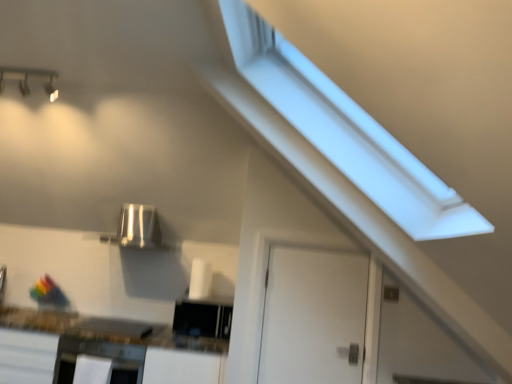
Question: Is satin silver appliance at center, acting as the first appliance starting from the left, far away from white matte door at center?

Choices:
 (A) no
 (B) yes

Answer: (B)

Question: Is satin silver appliance at center, marked as the second appliance in a bottom-to-top arrangement, located outside white matte door at center?

Choices:
 (A) yes
 (B) no

Answer: (A)

Question: Considering the relative sizes of satin silver appliance at center, marked as the second appliance in a bottom-to-top arrangement, and white matte door at center in the image provided, is satin silver appliance at center, marked as the second appliance in a bottom-to-top arrangement, wider than white matte door at center?

Choices:
 (A) no
 (B) yes

Answer: (B)

Question: Can you confirm if satin silver appliance at center, marked as the second appliance in a bottom-to-top arrangement, is taller than white matte door at center?

Choices:
 (A) no
 (B) yes

Answer: (A)

Question: Can you confirm if satin silver appliance at center, acting as the first appliance starting from the left, is shorter than white matte door at center?

Choices:
 (A) yes
 (B) no

Answer: (A)

Question: Is point (58, 360) positioned closer to the camera than point (268, 273)?

Choices:
 (A) closer
 (B) farther

Answer: (B)

Question: Is satin black oven at lower left inside or outside of white matte door at center?

Choices:
 (A) outside
 (B) inside

Answer: (A)

Question: Looking at the image, does satin black oven at lower left seem bigger or smaller compared to white matte door at center?

Choices:
 (A) small
 (B) big

Answer: (B)

Question: Is satin black oven at lower left to the left or to the right of white matte door at center in the image?

Choices:
 (A) left
 (B) right

Answer: (A)

Question: In terms of width, does satin silver appliance at center, the first appliance in the top-to-bottom sequence, look wider or thinner when compared to white matte door at center?

Choices:
 (A) thin
 (B) wide

Answer: (B)

Question: Based on their sizes in the image, would you say satin silver appliance at center, acting as the first appliance starting from the left, is bigger or smaller than white matte door at center?

Choices:
 (A) small
 (B) big

Answer: (B)

Question: Considering the positions of satin silver appliance at center, acting as the first appliance starting from the left, and white matte door at center in the image, is satin silver appliance at center, acting as the first appliance starting from the left, taller or shorter than white matte door at center?

Choices:
 (A) tall
 (B) short

Answer: (B)

Question: In the image, is satin silver appliance at center, the 2th appliance in the right-to-left sequence, positioned in front of or behind white matte door at center?

Choices:
 (A) front
 (B) behind

Answer: (B)

Question: From the image's perspective, relative to white glossy countertop at lower left, is satin silver appliance at center, acting as the first appliance starting from the left, above or below?

Choices:
 (A) above
 (B) below

Answer: (A)

Question: Would you say satin silver appliance at center, the 2th appliance in the right-to-left sequence, is inside or outside white glossy countertop at lower left?

Choices:
 (A) inside
 (B) outside

Answer: (B)